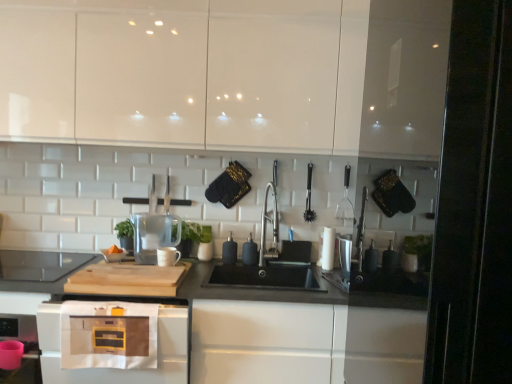
You are a GUI agent. You are given a task and a screenshot of the screen. Output one action in this format:
    pyautogui.click(x=<x>, y=<y>)
    Task: Click on the vacant region to the right of black matte soap dispenser at center, positioned as the 3th appliance in right-to-left order
    This screenshot has width=512, height=384.
    Given the screenshot: What is the action you would take?
    pyautogui.click(x=276, y=264)